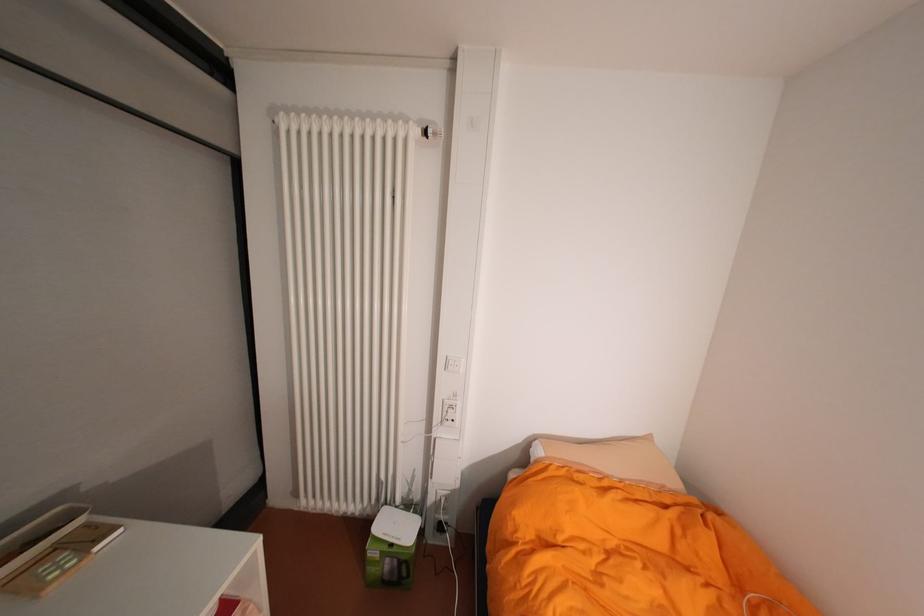
What do you see at coordinates (447, 419) in the screenshot? I see `a white wall socket` at bounding box center [447, 419].